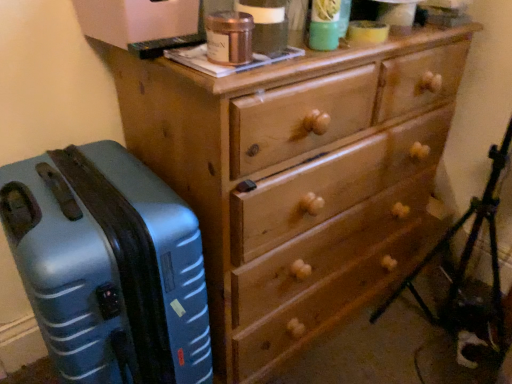
Question: Does wooden chest of drawers at center have a lesser height compared to blue matte suitcase at left?

Choices:
 (A) no
 (B) yes

Answer: (A)

Question: Is the position of wooden chest of drawers at center less distant than that of blue matte suitcase at left?

Choices:
 (A) no
 (B) yes

Answer: (A)

Question: From the image's perspective, is wooden chest of drawers at center beneath blue matte suitcase at left?

Choices:
 (A) no
 (B) yes

Answer: (A)

Question: Is wooden chest of drawers at center to the right of blue matte suitcase at left from the viewer's perspective?

Choices:
 (A) no
 (B) yes

Answer: (B)

Question: Is wooden chest of drawers at center next to blue matte suitcase at left and touching it?

Choices:
 (A) no
 (B) yes

Answer: (A)

Question: From the image's perspective, does wooden chest of drawers at center appear higher than blue matte suitcase at left?

Choices:
 (A) no
 (B) yes

Answer: (B)

Question: Considering the relative sizes of blue matte suitcase at left and wooden chest of drawers at center in the image provided, is blue matte suitcase at left bigger than wooden chest of drawers at center?

Choices:
 (A) yes
 (B) no

Answer: (B)

Question: Is the position of blue matte suitcase at left less distant than that of wooden chest of drawers at center?

Choices:
 (A) yes
 (B) no

Answer: (A)

Question: Considering the relative sizes of blue matte suitcase at left and wooden chest of drawers at center in the image provided, is blue matte suitcase at left wider than wooden chest of drawers at center?

Choices:
 (A) no
 (B) yes

Answer: (A)

Question: Does blue matte suitcase at left have a greater height compared to wooden chest of drawers at center?

Choices:
 (A) no
 (B) yes

Answer: (A)

Question: Does blue matte suitcase at left have a lesser width compared to wooden chest of drawers at center?

Choices:
 (A) yes
 (B) no

Answer: (A)

Question: Is blue matte suitcase at left completely or partially outside of wooden chest of drawers at center?

Choices:
 (A) no
 (B) yes

Answer: (B)

Question: Based on their sizes in the image, would you say blue matte suitcase at left is bigger or smaller than wooden chest of drawers at center?

Choices:
 (A) small
 (B) big

Answer: (A)